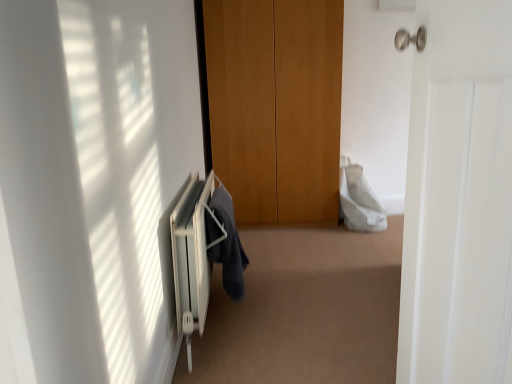
Question: From a real-world perspective, is white metallic radiator at lower left positioned under dark gray fabric at lower center based on gravity?

Choices:
 (A) no
 (B) yes

Answer: (B)

Question: Does white metallic radiator at lower left have a lesser width compared to dark gray fabric at lower center?

Choices:
 (A) no
 (B) yes

Answer: (A)

Question: From a real-world perspective, is white metallic radiator at lower left on dark gray fabric at lower center?

Choices:
 (A) yes
 (B) no

Answer: (B)

Question: Is white metallic radiator at lower left not close to dark gray fabric at lower center?

Choices:
 (A) yes
 (B) no

Answer: (B)

Question: Can you confirm if white metallic radiator at lower left is shorter than dark gray fabric at lower center?

Choices:
 (A) no
 (B) yes

Answer: (A)

Question: Is the depth of white metallic radiator at lower left greater than that of dark gray fabric at lower center?

Choices:
 (A) yes
 (B) no

Answer: (B)

Question: From a real-world perspective, does white matte door at right sit lower than white metallic radiator at lower left?

Choices:
 (A) no
 (B) yes

Answer: (A)

Question: Is white matte door at right positioned with its back to white metallic radiator at lower left?

Choices:
 (A) no
 (B) yes

Answer: (A)

Question: Does white matte door at right turn towards white metallic radiator at lower left?

Choices:
 (A) yes
 (B) no

Answer: (B)

Question: Is white matte door at right not close to white metallic radiator at lower left?

Choices:
 (A) no
 (B) yes

Answer: (A)

Question: From the image's perspective, is white matte door at right over white metallic radiator at lower left?

Choices:
 (A) yes
 (B) no

Answer: (A)

Question: Considering the relative positions of white matte door at right and white metallic radiator at lower left in the image provided, is white matte door at right to the right of white metallic radiator at lower left from the viewer's perspective?

Choices:
 (A) no
 (B) yes

Answer: (B)

Question: From a real-world perspective, is dark gray fabric at lower center on top of white matte door at right?

Choices:
 (A) no
 (B) yes

Answer: (A)